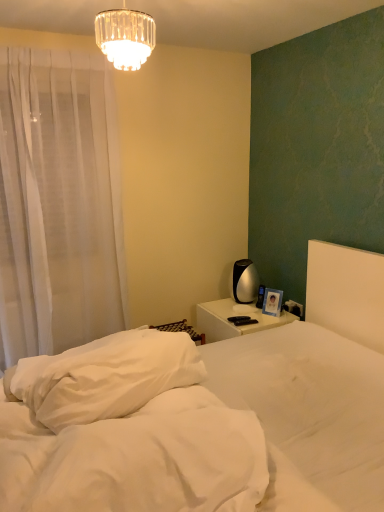
Question: From a real-world perspective, is crystal glass chandelier at upper center located beneath white soft bed at center?

Choices:
 (A) yes
 (B) no

Answer: (B)

Question: Does crystal glass chandelier at upper center turn towards white soft bed at center?

Choices:
 (A) no
 (B) yes

Answer: (A)

Question: Is crystal glass chandelier at upper center beside white soft bed at center?

Choices:
 (A) no
 (B) yes

Answer: (A)

Question: Is the position of crystal glass chandelier at upper center less distant than that of white soft bed at center?

Choices:
 (A) yes
 (B) no

Answer: (B)

Question: Is crystal glass chandelier at upper center positioned behind white soft bed at center?

Choices:
 (A) yes
 (B) no

Answer: (A)

Question: Does point (292, 304) appear closer or farther from the camera than point (258, 321)?

Choices:
 (A) farther
 (B) closer

Answer: (A)

Question: Relative to white glossy nightstand at center, is black plastic electric outlet at right in front or behind?

Choices:
 (A) behind
 (B) front

Answer: (A)

Question: Would you say black plastic electric outlet at right is inside or outside white glossy nightstand at center?

Choices:
 (A) inside
 (B) outside

Answer: (B)

Question: Is black plastic electric outlet at right wider or thinner than white glossy nightstand at center?

Choices:
 (A) wide
 (B) thin

Answer: (B)

Question: Looking at the image, does white glossy nightstand at center seem bigger or smaller compared to white soft pillow at left?

Choices:
 (A) big
 (B) small

Answer: (A)

Question: Would you say white glossy nightstand at center is to the left or to the right of white soft pillow at left in the picture?

Choices:
 (A) right
 (B) left

Answer: (A)

Question: From their relative heights in the image, would you say white glossy nightstand at center is taller or shorter than white soft pillow at left?

Choices:
 (A) tall
 (B) short

Answer: (A)

Question: Is white glossy nightstand at center wider or thinner than white soft pillow at left?

Choices:
 (A) wide
 (B) thin

Answer: (A)

Question: Is black plastic electric outlet at right wider or thinner than white soft mattress at lower center?

Choices:
 (A) thin
 (B) wide

Answer: (A)

Question: In terms of size, does black plastic electric outlet at right appear bigger or smaller than white soft mattress at lower center?

Choices:
 (A) small
 (B) big

Answer: (A)